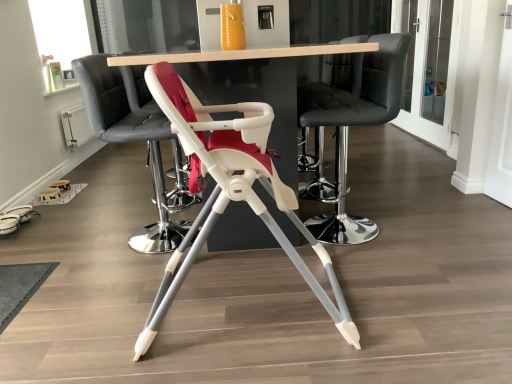
Question: Is white plastic highchair at center, marked as the 3th chair in a front-to-back arrangement, to the left of wooden table at center from the viewer's perspective?

Choices:
 (A) yes
 (B) no

Answer: (A)

Question: Is white plastic highchair at center, which appears as the second chair when viewed from the back, outside wooden table at center?

Choices:
 (A) no
 (B) yes

Answer: (A)

Question: Is wooden table at center at the back of white plastic highchair at center, which appears as the second chair when viewed from the back?

Choices:
 (A) no
 (B) yes

Answer: (B)

Question: From a real-world perspective, is white plastic highchair at center, marked as the 3th chair in a front-to-back arrangement, located beneath wooden table at center?

Choices:
 (A) no
 (B) yes

Answer: (A)

Question: Is there a large distance between white plastic highchair at center, which appears as the second chair when viewed from the back, and wooden table at center?

Choices:
 (A) yes
 (B) no

Answer: (B)

Question: From a real-world perspective, relative to white plastic highchair at center, which is the first chair in front-to-back order, is wooden table at center vertically above or below?

Choices:
 (A) above
 (B) below

Answer: (A)

Question: Does point tap(233, 52) appear closer or farther from the camera than point tap(323, 263)?

Choices:
 (A) closer
 (B) farther

Answer: (B)

Question: Relative to white plastic highchair at center, positioned as the fourth chair in back-to-front order, is wooden table at center in front or behind?

Choices:
 (A) behind
 (B) front

Answer: (A)

Question: From the image's perspective, is wooden table at center positioned above or below white plastic highchair at center, which is the first chair in front-to-back order?

Choices:
 (A) below
 (B) above

Answer: (B)

Question: From the image's perspective, relative to black leather bar stool at center, placed as the 2th chair when sorted from front to back, is white plastic highchair at center, which is the first chair in front-to-back order, above or below?

Choices:
 (A) below
 (B) above

Answer: (A)

Question: Looking at their shapes, would you say white plastic highchair at center, which is the first chair in front-to-back order, is wider or thinner than black leather bar stool at center, arranged as the 3th chair when viewed from the back?

Choices:
 (A) thin
 (B) wide

Answer: (B)

Question: Considering the relative positions of white plastic highchair at center, which is the first chair in front-to-back order, and black leather bar stool at center, placed as the 2th chair when sorted from front to back, in the image provided, is white plastic highchair at center, which is the first chair in front-to-back order, to the left or to the right of black leather bar stool at center, placed as the 2th chair when sorted from front to back,?

Choices:
 (A) right
 (B) left

Answer: (B)

Question: Is white plastic highchair at center, which is the first chair in front-to-back order, situated inside black leather bar stool at center, placed as the 2th chair when sorted from front to back, or outside?

Choices:
 (A) inside
 (B) outside

Answer: (B)

Question: Would you say wooden table at center is inside or outside black leather bar stool at center, the first chair from the back?

Choices:
 (A) outside
 (B) inside

Answer: (A)

Question: Considering their positions, is wooden table at center located in front of or behind black leather bar stool at center, placed as the 4th chair when sorted from front to back?

Choices:
 (A) front
 (B) behind

Answer: (A)